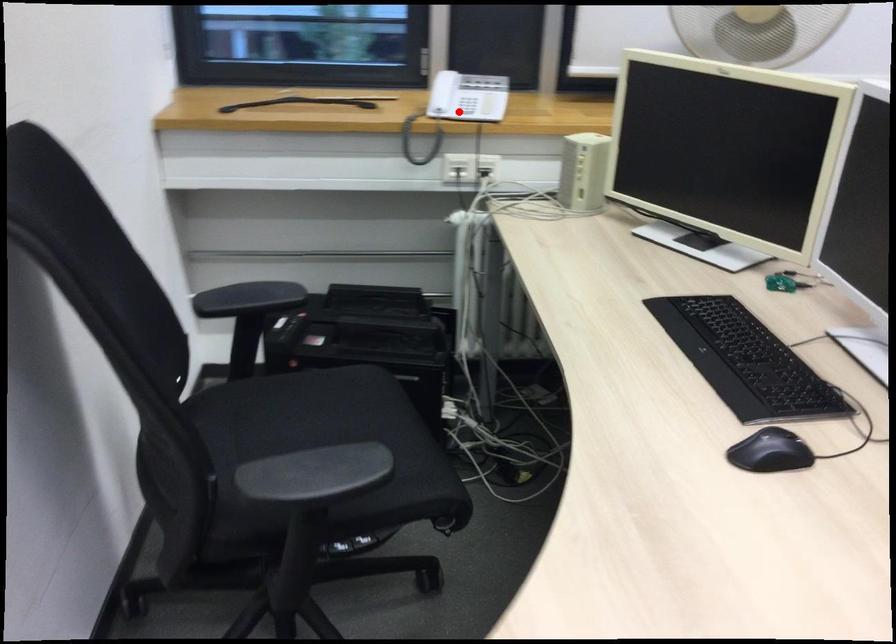
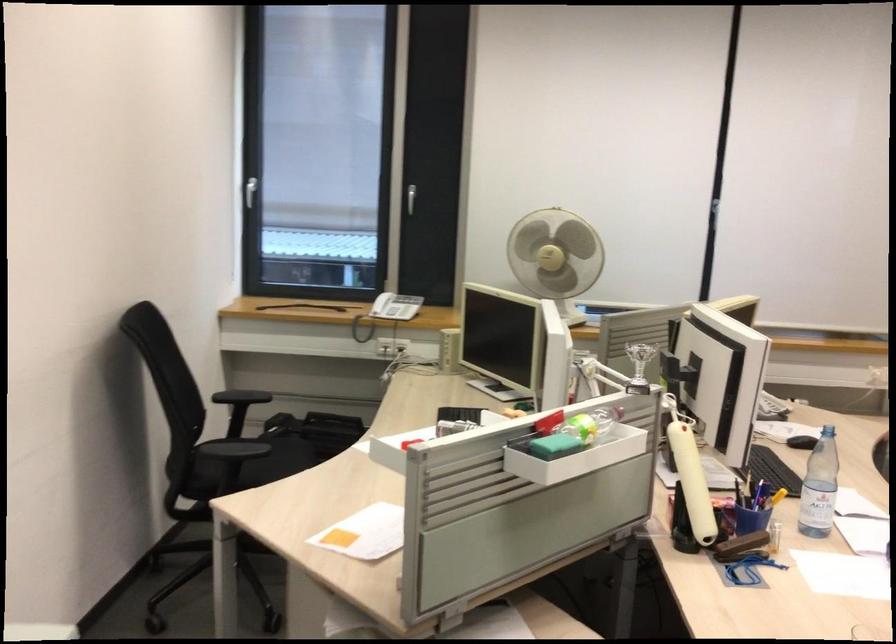
The point at the highlighted location is marked in the first image. Where is the corresponding point in the second image?

(386, 312)